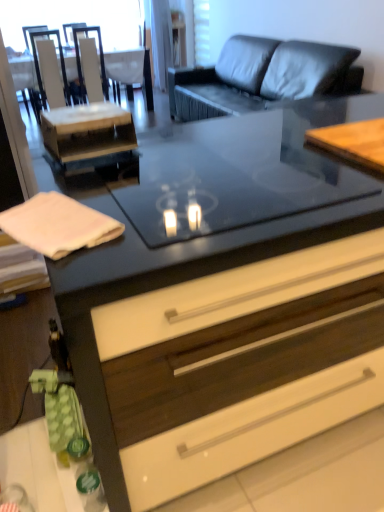
Question: Is white glossy armchair at upper left, placed as the 2th armchair when sorted from left to right, located within white glossy armchair at upper left, the first armchair when ordered from left to right?

Choices:
 (A) yes
 (B) no

Answer: (B)

Question: From the image's perspective, is white glossy armchair at upper left, which ranks as the 3th armchair in right-to-left order, above white glossy armchair at upper left, which is counted as the 2th armchair, starting from the right?

Choices:
 (A) yes
 (B) no

Answer: (B)

Question: Is white glossy armchair at upper left, the first armchair when ordered from left to right, bigger than white glossy armchair at upper left, placed as the 2th armchair when sorted from left to right?

Choices:
 (A) yes
 (B) no

Answer: (B)

Question: Does white glossy armchair at upper left, which ranks as the 3th armchair in right-to-left order, have a greater height compared to white glossy armchair at upper left, placed as the 2th armchair when sorted from left to right?

Choices:
 (A) no
 (B) yes

Answer: (B)

Question: Does white glossy armchair at upper left, the first armchair when ordered from left to right, turn towards white glossy armchair at upper left, placed as the 2th armchair when sorted from left to right?

Choices:
 (A) no
 (B) yes

Answer: (A)

Question: Is white glossy armchair at upper left, the first armchair when ordered from left to right, looking in the opposite direction of white glossy armchair at upper left, which is counted as the 2th armchair, starting from the right?

Choices:
 (A) yes
 (B) no

Answer: (B)

Question: Considering the relative sizes of dark gray leather couch at upper center and white glossy armchair at upper left, which ranks as the 3th armchair in right-to-left order, in the image provided, is dark gray leather couch at upper center wider than white glossy armchair at upper left, which ranks as the 3th armchair in right-to-left order,?

Choices:
 (A) no
 (B) yes

Answer: (B)

Question: Does dark gray leather couch at upper center have a smaller size compared to white glossy armchair at upper left, the first armchair when ordered from left to right?

Choices:
 (A) yes
 (B) no

Answer: (B)

Question: Does dark gray leather couch at upper center appear on the right side of white glossy armchair at upper left, the first armchair when ordered from left to right?

Choices:
 (A) no
 (B) yes

Answer: (B)

Question: Does dark gray leather couch at upper center appear on the left side of white glossy armchair at upper left, which ranks as the 3th armchair in right-to-left order?

Choices:
 (A) no
 (B) yes

Answer: (A)

Question: From the image's perspective, does dark gray leather couch at upper center appear lower than white glossy armchair at upper left, the first armchair when ordered from left to right?

Choices:
 (A) no
 (B) yes

Answer: (B)

Question: Does dark gray leather couch at upper center come in front of white glossy armchair at upper left, the first armchair when ordered from left to right?

Choices:
 (A) no
 (B) yes

Answer: (B)

Question: Can you confirm if white fabric armchair at upper center, which is counted as the 3th armchair, starting from the left, is wider than matte black drawer at center?

Choices:
 (A) yes
 (B) no

Answer: (B)